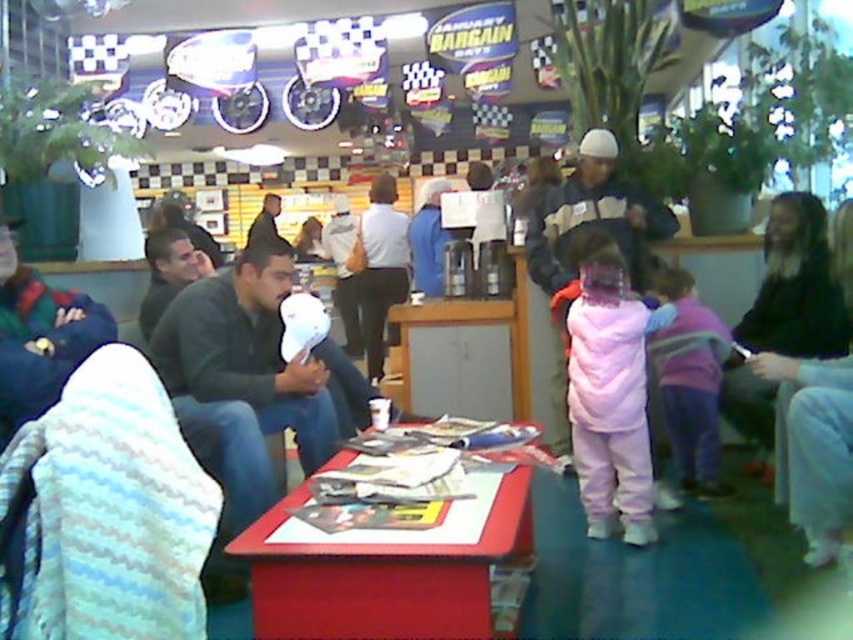
You are a delivery person who needs to place a small package on the red plastic table at center. However, there is a purple fleece jacket at center nearby. Can you place the package there without moving the jacket?

The red plastic table at center and purple fleece jacket at center are 1.46 meters apart from each other. Since the distance between them is more than a meter, there is enough space to place the package on the red plastic table at center without disturbing the jacket.

You are a customer at this cafe and want to place your green fleece jacket at left on the red plastic table at center. Will the jacket fit on the table without hanging off the edges?

The red plastic table at center has a lesser height compared to green fleece jacket at left, meaning the jacket may hang off the edges when placed on the table since it is taller than the table.